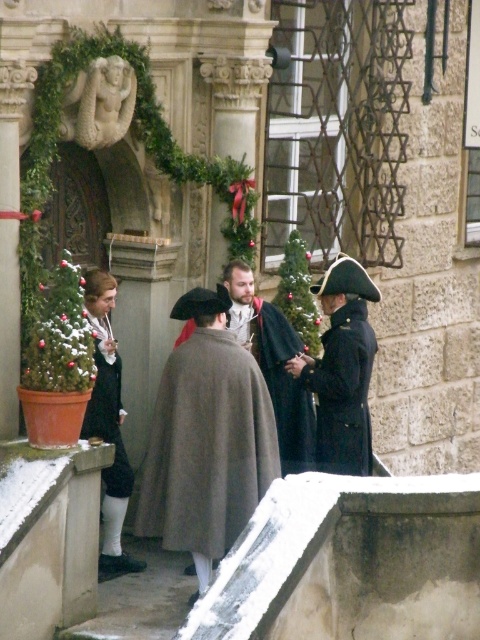
You are standing in the winter scene and want to pick up the brown woolen cape at center. Where should you look to find it?

The brown woolen cape at center is located at the coordinates 0.572 on the x axis and 0.569 on the y axis.

You are standing at the center of the scene and want to hand a small package to both individuals wearing the brown woolen cape at center. Can you reach both of them without moving from your current position?

The two individuals wearing the brown woolen cape at center are 26.17 meters apart, so you cannot reach both of them without moving from your current position because the distance is too large.

You are a costume designer trying to decide which garment to use for a winter scene. You have the gray woolen cloak at center and the dark gray woolen robe at center. Based on their sizes, which one would cover more area if both are laid flat?

The gray woolen cloak at center might be wider than dark gray woolen robe at center, so the gray woolen cloak at center would cover more area when laid flat.